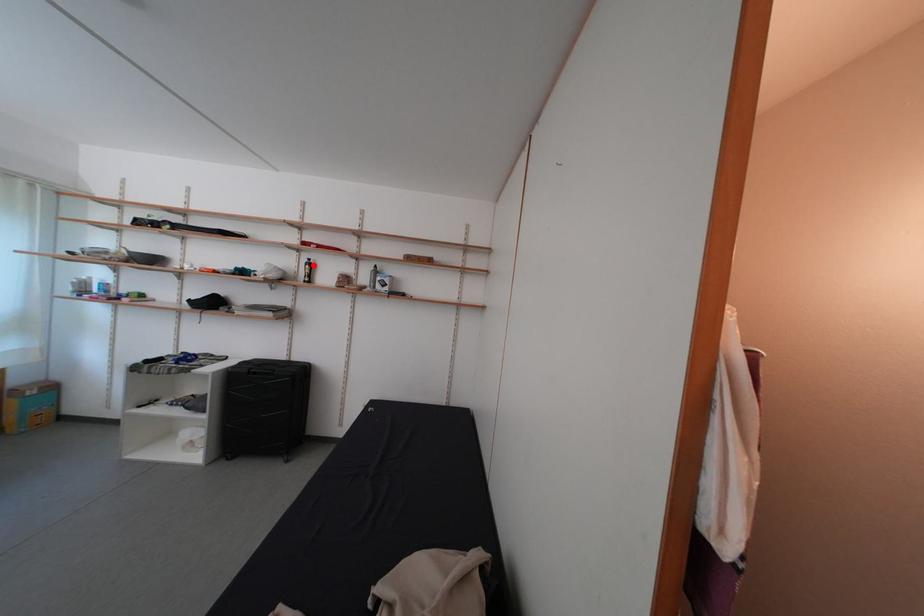
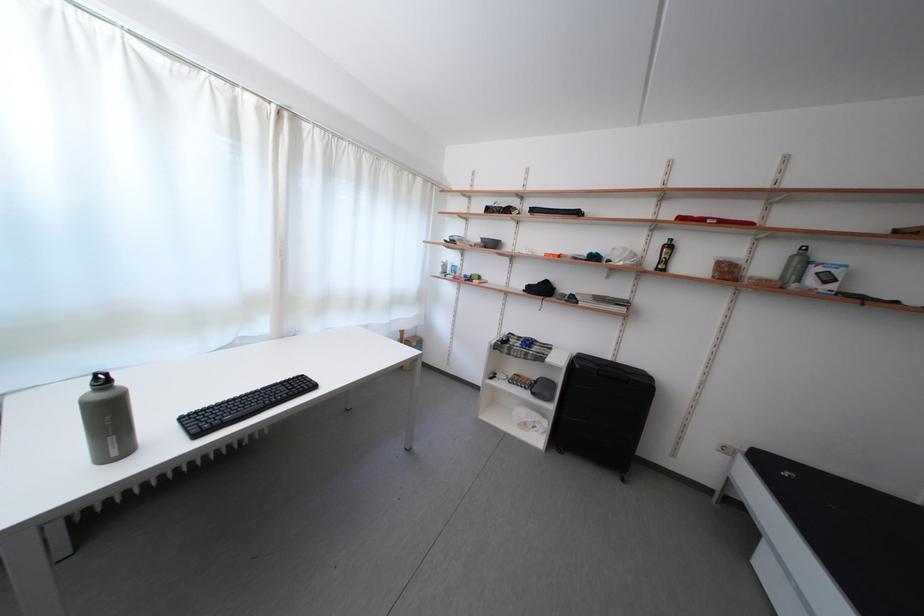
Locate, in the second image, the point that corresponds to the highlighted location in the first image.

(669, 246)